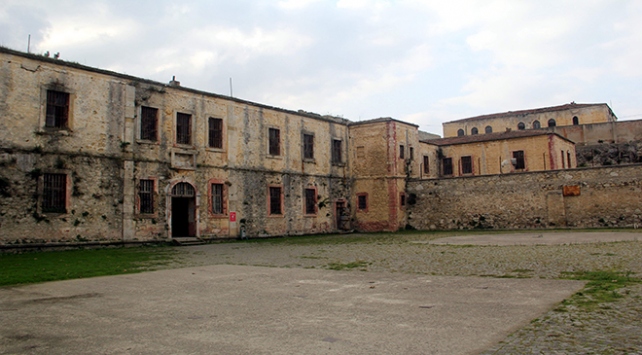
Where is `door`? door is located at coordinates (549, 197).